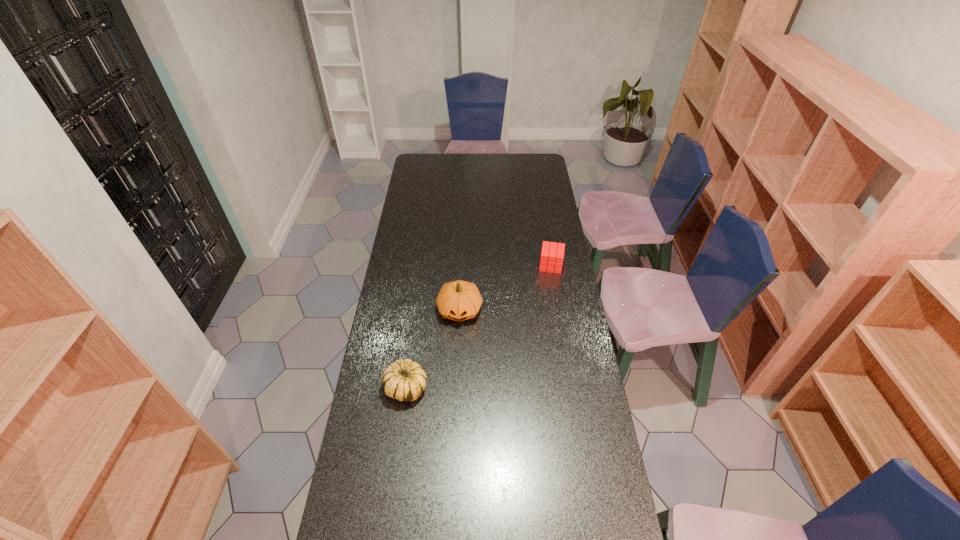
You are a GUI agent. You are given a task and a screenshot of the screen. Output one action in this format:
    pyautogui.click(x=<x>, y=<y>)
    Task: Click on the second object from left to right
    This screenshot has height=540, width=960.
    Given the screenshot: What is the action you would take?
    pyautogui.click(x=459, y=300)

In order to click on the farther gourd in this screenshot , I will do `click(459, 300)`.

Where is `the left gourd`? This screenshot has height=540, width=960. the left gourd is located at coordinates (405, 380).

The image size is (960, 540). In order to click on the nearer gourd in this screenshot , I will do `click(405, 380)`.

This screenshot has width=960, height=540. I want to click on cube, so click(x=554, y=256).

Where is `the shortest object`? The height and width of the screenshot is (540, 960). the shortest object is located at coordinates (554, 256).

Find the location of `vacant space situated 0.300m on the side of the second object from right to left with the carved face`. vacant space situated 0.300m on the side of the second object from right to left with the carved face is located at coordinates (456, 395).

Locate an element on the screen. The height and width of the screenshot is (540, 960). free space located on the back of the nearer gourd is located at coordinates (412, 341).

This screenshot has width=960, height=540. In order to click on vacant space located on the front of the rightmost object in this screenshot , I will do `click(554, 286)`.

Find the location of a particular element. The height and width of the screenshot is (540, 960). object situated at the left edge is located at coordinates (405, 380).